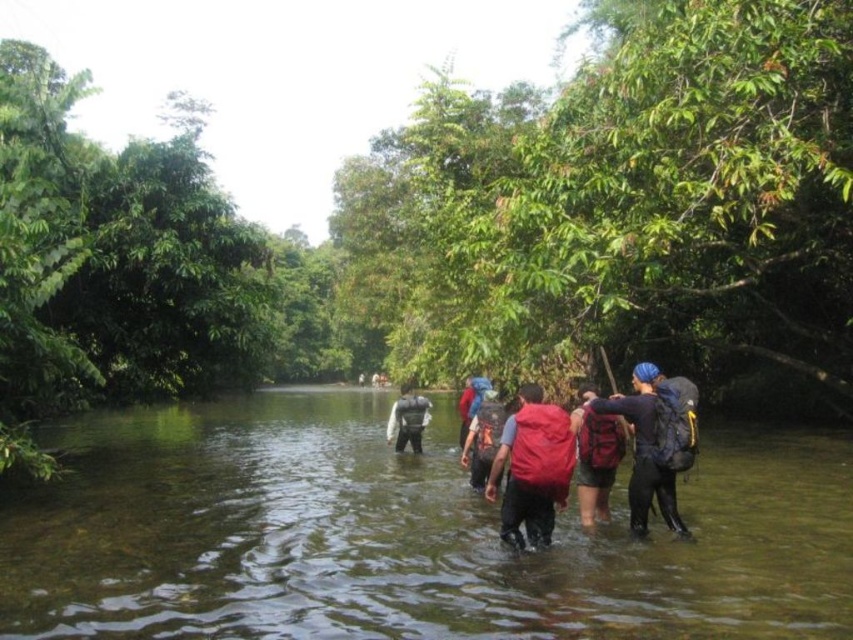
You are a hiker trying to cross the clear water stream at center while carrying a matte black backpack at center. Can you safely cross the stream without the backpack getting submerged?

The clear water stream at center is wider than the matte black backpack at center, so you can safely cross the stream without the backpack getting submerged as long as you keep your balance.

You are a hiker trying to cross the shallow river. You notice two points marked in the scene. Which point, point (601,456) or point (421,413), is closer to you as you stand at the riverbank?

Point (601,456) is closer to the viewer than point (421,413), so the closer point is point (601,456).

You are a hiker trying to decide which backpack to place first in the river. Based on the scene, which backpack, the red backpack at center or the matte gray backpack at center, is taller and therefore might be more stable when submerged?

The red backpack at center is taller than the matte gray backpack at center, so it might be more stable when submerged.